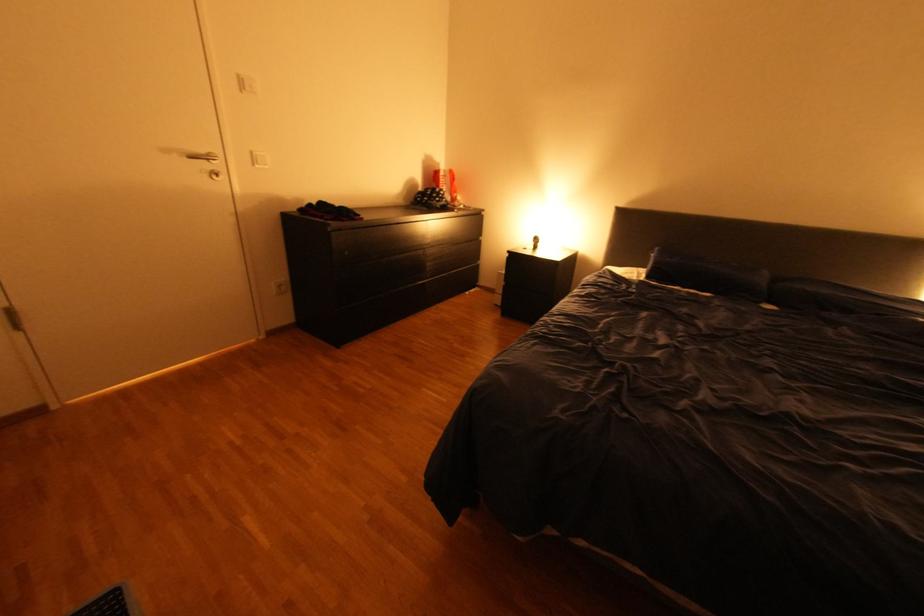
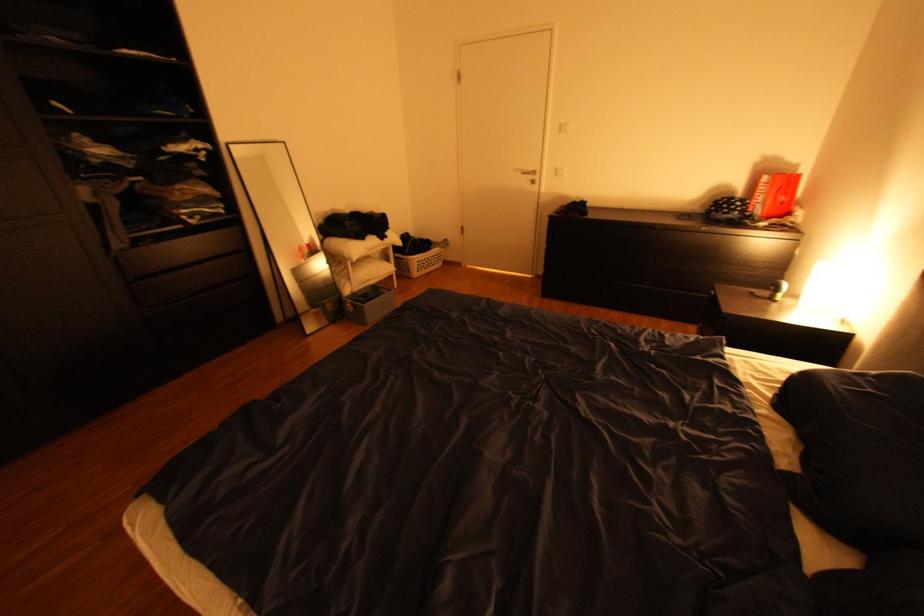
Locate, in the second image, the point that corresponds to (176,150) in the first image.

(526, 171)